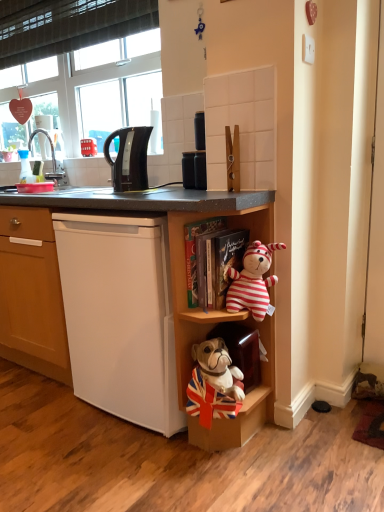
Locate an element on the screen. The height and width of the screenshot is (512, 384). vacant space underneath striped plush toy at upper right (from a real-world perspective) is located at coordinates (274, 439).